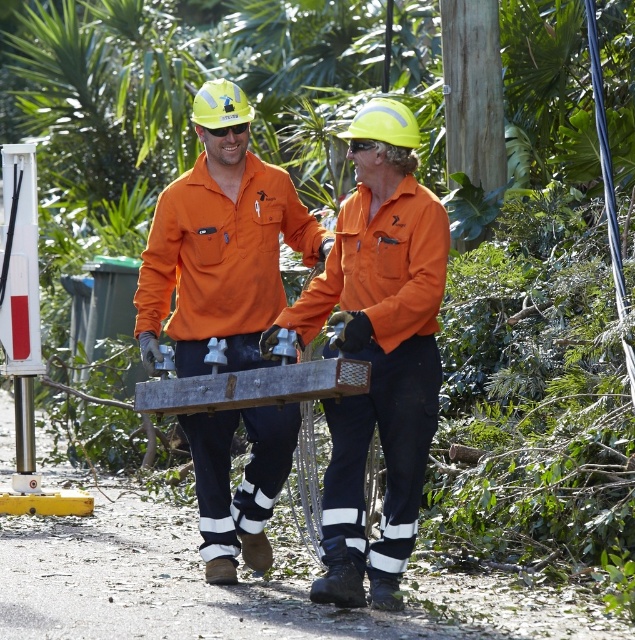
Question: Does orange matte workwear at center lie in front of matte orange shirt at center?

Choices:
 (A) no
 (B) yes

Answer: (B)

Question: Is orange matte workwear at center below matte orange shirt at center?

Choices:
 (A) yes
 (B) no

Answer: (A)

Question: Among these objects, which one is farthest from the camera?

Choices:
 (A) orange matte workwear at center
 (B) matte orange shirt at center

Answer: (B)

Question: Does orange matte workwear at center have a greater width compared to matte orange shirt at center?

Choices:
 (A) no
 (B) yes

Answer: (A)